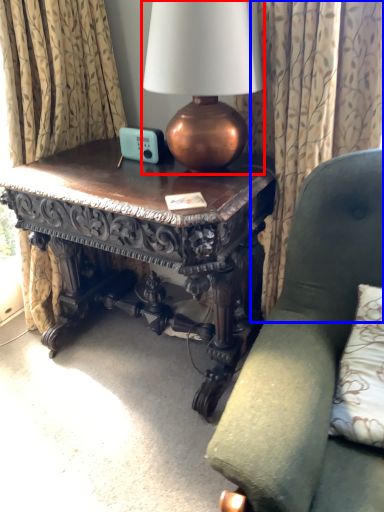
Question: Which point is closer to the camera, lamp (highlighted by a red box) or curtain (highlighted by a blue box)?

Choices:
 (A) lamp
 (B) curtain

Answer: (A)